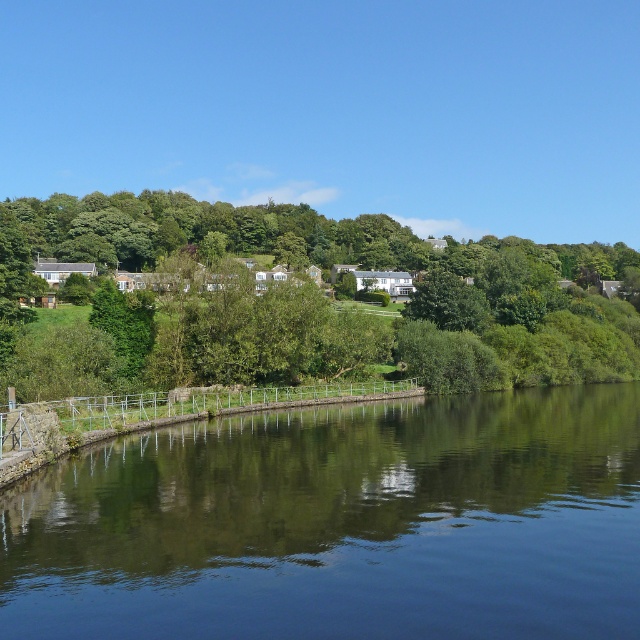
Question: Which of the following is the farthest from the observer?

Choices:
 (A) green leafy tree at center
 (B) dark blue water at center

Answer: (A)

Question: Does dark blue water at center appear on the left side of green leafy tree at center?

Choices:
 (A) no
 (B) yes

Answer: (B)

Question: Is dark blue water at center smaller than green leafy tree at center?

Choices:
 (A) no
 (B) yes

Answer: (B)

Question: Does dark blue water at center have a larger size compared to green leafy tree at center?

Choices:
 (A) no
 (B) yes

Answer: (A)

Question: Which object appears farthest from the camera in this image?

Choices:
 (A) dark blue water at center
 (B) green leafy tree at center

Answer: (B)